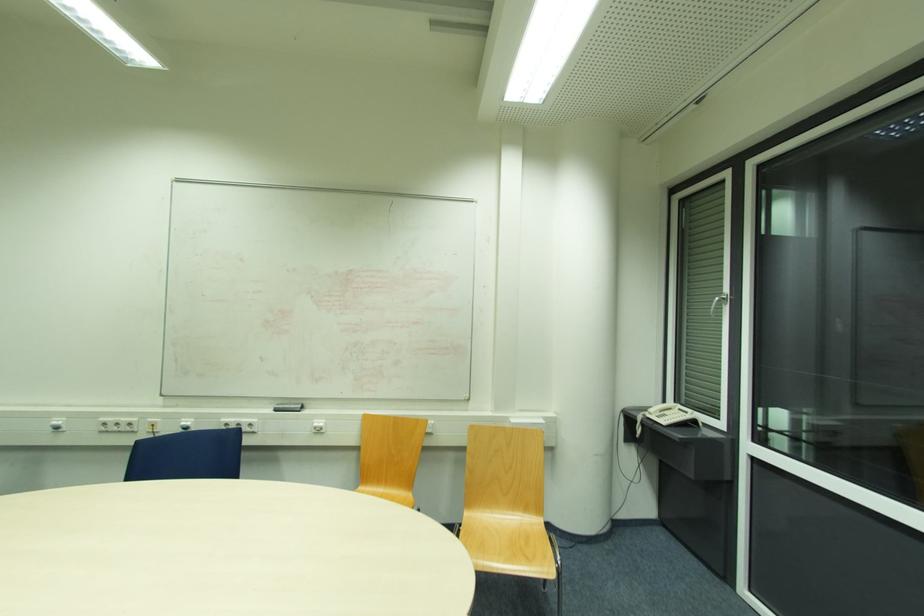
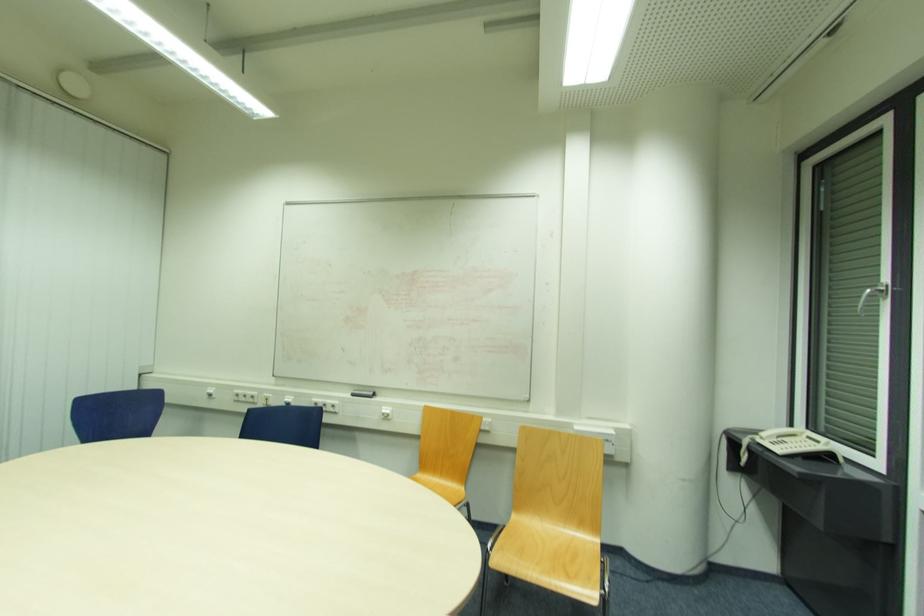
Question: The camera is either moving clockwise (left) or counter-clockwise (right) around the object. The first image is from the beginning of the video and the second image is from the end. Is the camera moving left or right when shooting the video?

Choices:
 (A) Left
 (B) Right

Answer: (B)